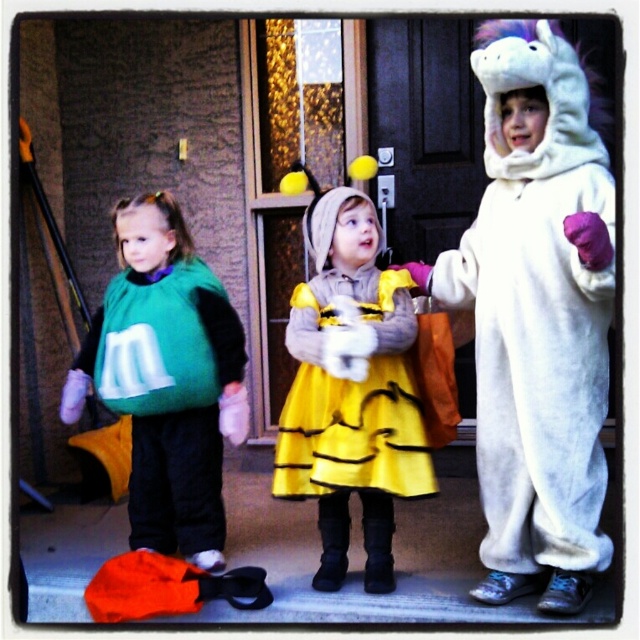
You are a photographer trying to capture a group photo of the white furry unicorn at right and the yellow satin dress at center. The camera you are using has a minimum focus distance of 12 inches. Will you be able to focus on both subjects simultaneously without moving the camera?

The distance between the white furry unicorn at right and the yellow satin dress at center is 12.79 inches, which exceeds the camera minimum focus distance of 12 inches. Therefore, the camera can focus on both subjects simultaneously.

You are standing on the porch and want to place a decoration between the two points, point (522, 84) and point (337, 502). Which point should you stand closer to so the decoration is placed in between them?

To place the decoration between point (522, 84) and point (337, 502), you should stand closer to point (337, 502) since point (522, 84) is in front of it, meaning it is closer to you. The midpoint would require positioning between them, but since the question asks which point to stand closer to, the one further away needs adjustment.